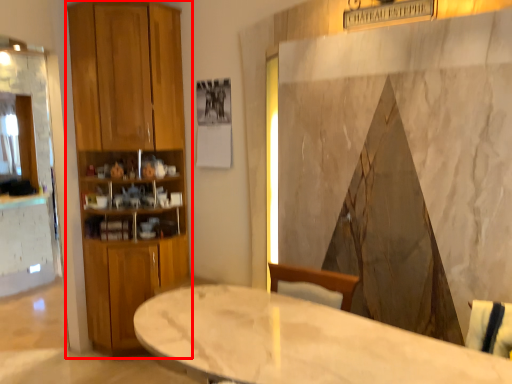
Question: Where is closet (annotated by the red box) located in relation to table in the image?

Choices:
 (A) right
 (B) left

Answer: (B)